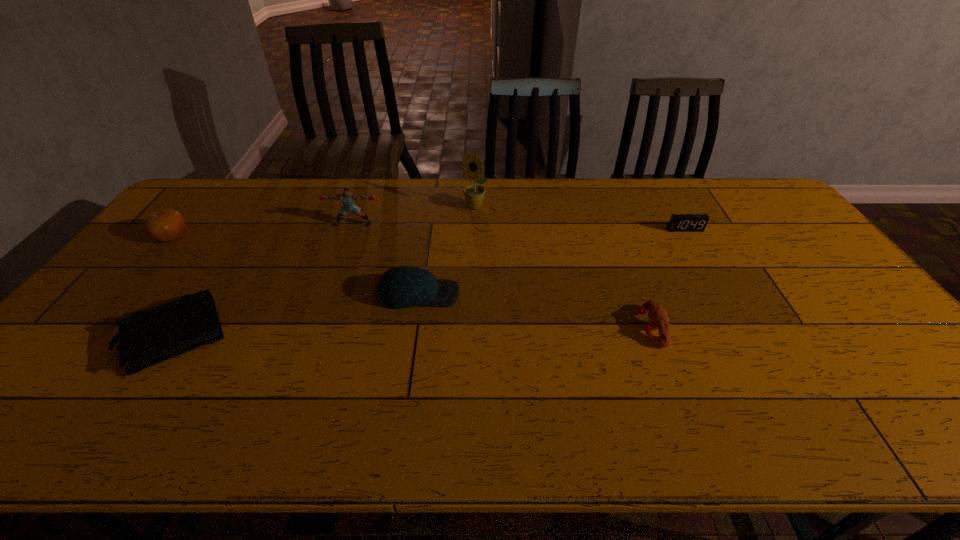
Identify the location of clementine that is positioned at the left edge. (164, 225).

Locate an element on the screen. The width and height of the screenshot is (960, 540). Bible that is at the left edge is located at coordinates (146, 338).

Find the location of `blank space at the far edge of the desktop`. blank space at the far edge of the desktop is located at coordinates (655, 213).

Image resolution: width=960 pixels, height=540 pixels. In the image, there is a desktop. Identify the location of vacant space at the near edge. (252, 415).

Find the location of a particular element. This screenshot has height=540, width=960. vacant space at the left edge is located at coordinates (61, 347).

At what (x,y) coordinates should I click in order to perform the action: click on vacant area at the right edge of the desktop. Please return your answer as a coordinate pair (x, y). The height and width of the screenshot is (540, 960). Looking at the image, I should click on point(804,267).

The height and width of the screenshot is (540, 960). In the image, there is a desktop. Identify the location of free space at the far left corner. coord(221,195).

In the image, there is a desktop. Identify the location of vacant space at the near left corner. This screenshot has width=960, height=540. (16, 412).

At what (x,y) coordinates should I click in order to perform the action: click on free space between the second object from right to left and the left puncher. Please return your answer as a coordinate pair (x, y). Image resolution: width=960 pixels, height=540 pixels. Looking at the image, I should click on (502, 276).

I want to click on vacant space that's between the baseball cap and the left puncher, so click(x=386, y=259).